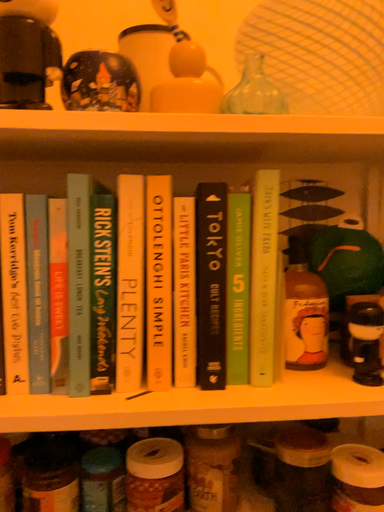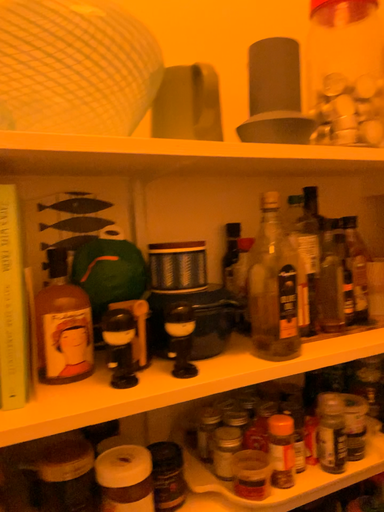
Question: Which way did the camera rotate in the video?

Choices:
 (A) rotated right
 (B) rotated left

Answer: (A)